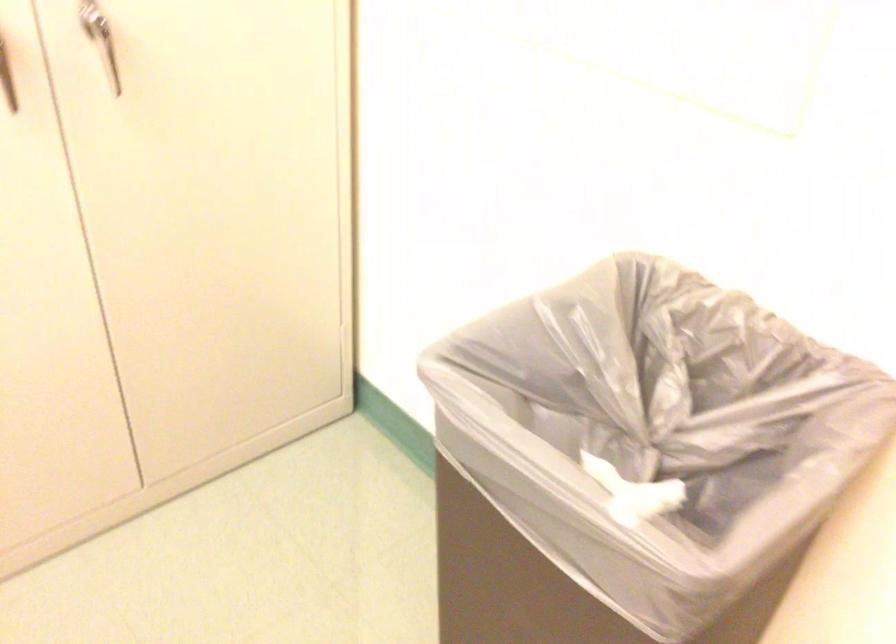
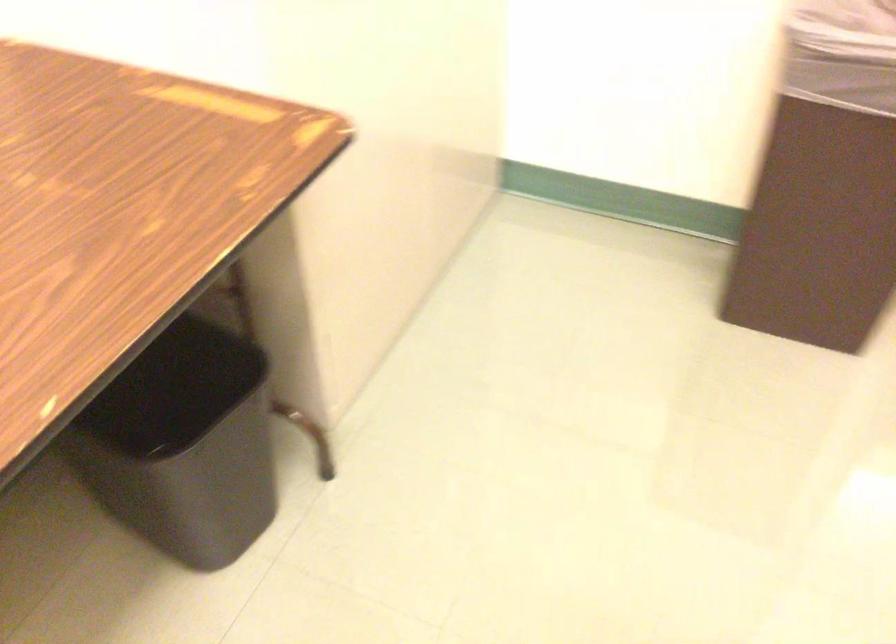
Question: In a continuous first-person perspective shot, in which direction is the camera moving?

Choices:
 (A) Left
 (B) Right
 (C) Forward
 (D) Backward

Answer: (A)